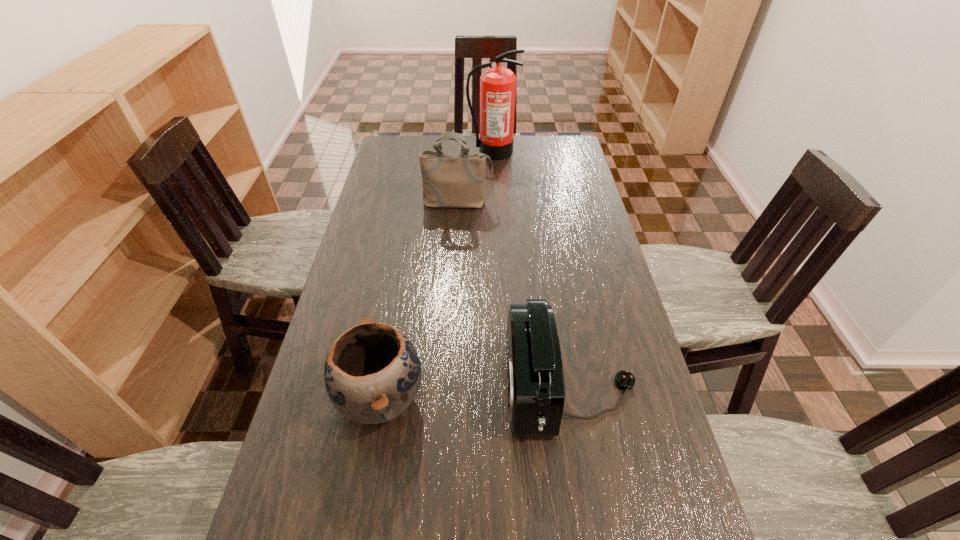
You are a GUI agent. You are given a task and a screenshot of the screen. Output one action in this format:
    pyautogui.click(x=<x>, y=<y>)
    Task: Click on the fire extinguisher
    The height and width of the screenshot is (540, 960).
    Given the screenshot: What is the action you would take?
    pyautogui.click(x=497, y=85)

At what (x,y) coordinates should I click in order to perform the action: click on the farthest object. Please return your answer as a coordinate pair (x, y). Looking at the image, I should click on (497, 85).

You are a GUI agent. You are given a task and a screenshot of the screen. Output one action in this format:
    pyautogui.click(x=<x>, y=<y>)
    Task: Click on the shoulder bag
    
    Given the screenshot: What is the action you would take?
    coord(449,180)

Image resolution: width=960 pixels, height=540 pixels. In order to click on the third nearest object in this screenshot , I will do `click(449, 180)`.

Find the location of a particular element. radio receiver is located at coordinates (535, 379).

The width and height of the screenshot is (960, 540). I want to click on pottery, so click(372, 372).

The image size is (960, 540). In order to click on vacant area situated on the front side of the fire extinguisher in this screenshot , I will do `click(494, 186)`.

I want to click on vacant space located 0.170m on the front-facing side of the third shortest object, so click(x=455, y=243).

Where is `free spot located 0.280m on the front-facing side of the radio receiver`? The width and height of the screenshot is (960, 540). free spot located 0.280m on the front-facing side of the radio receiver is located at coordinates (390, 386).

At what (x,y) coordinates should I click in order to perform the action: click on vacant area situated on the front-facing side of the radio receiver. Please return your answer as a coordinate pair (x, y). This screenshot has height=540, width=960. Looking at the image, I should click on (476, 386).